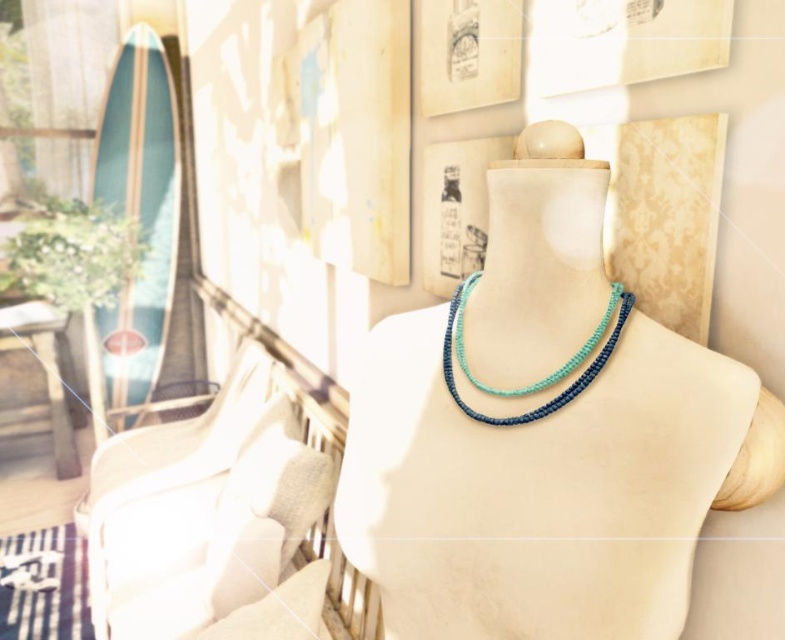
You are an interior designer trying to choose between two necklaces displayed on a mannequin torso. The teal beaded necklace at center and the teal woven necklace at center are both in the center. Which necklace takes up more space?

The teal beaded necklace at center has a larger size compared to the teal woven necklace at center, so it takes up more space.

You are an interior designer arranging items on a display shelf. You have two teal necklaces in front of you. The teal beaded necklace at center and the teal woven necklace at center. Which one is positioned to the right of the other?

The teal beaded necklace at center is positioned to the right of the teal woven necklace at center.